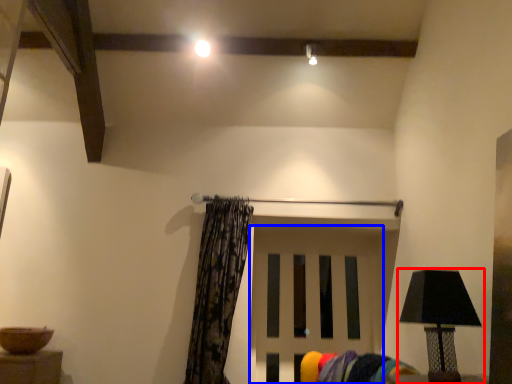
Question: Which of the following is the closest to the observer, lamp (highlighted by a red box) or door (highlighted by a blue box)?

Choices:
 (A) lamp
 (B) door

Answer: (A)